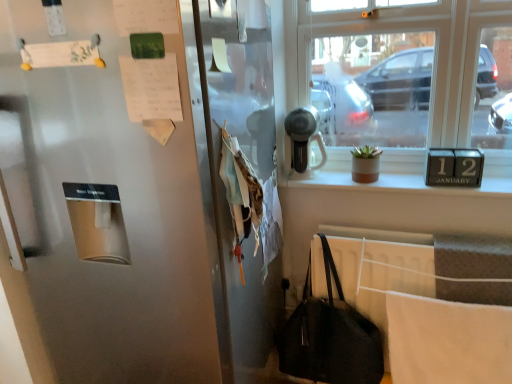
Question: Is clear glass window at upper right at the right side of satin silver hairdryer at upper center?

Choices:
 (A) yes
 (B) no

Answer: (A)

Question: Does clear glass window at upper right have a lesser height compared to satin silver hairdryer at upper center?

Choices:
 (A) no
 (B) yes

Answer: (A)

Question: Considering the relative positions of clear glass window at upper right and satin silver hairdryer at upper center in the image provided, is clear glass window at upper right in front of satin silver hairdryer at upper center?

Choices:
 (A) yes
 (B) no

Answer: (A)

Question: From a real-world perspective, is clear glass window at upper right on top of satin silver hairdryer at upper center?

Choices:
 (A) no
 (B) yes

Answer: (B)

Question: Could you tell me if clear glass window at upper right is facing satin silver hairdryer at upper center?

Choices:
 (A) no
 (B) yes

Answer: (B)

Question: Is clear glass window at upper right at the left side of satin silver hairdryer at upper center?

Choices:
 (A) no
 (B) yes

Answer: (A)

Question: Could clear glass window at upper right be considered to be inside black leather handbag at lower right?

Choices:
 (A) no
 (B) yes

Answer: (A)

Question: Considering the relative sizes of black leather handbag at lower right and clear glass window at upper right in the image provided, is black leather handbag at lower right wider than clear glass window at upper right?

Choices:
 (A) no
 (B) yes

Answer: (B)

Question: Does black leather handbag at lower right come behind clear glass window at upper right?

Choices:
 (A) no
 (B) yes

Answer: (A)

Question: Is black leather handbag at lower right at the left side of clear glass window at upper right?

Choices:
 (A) no
 (B) yes

Answer: (B)

Question: Can you confirm if black leather handbag at lower right is smaller than clear glass window at upper right?

Choices:
 (A) no
 (B) yes

Answer: (B)

Question: Is black leather handbag at lower right closer to camera compared to clear glass window at upper right?

Choices:
 (A) no
 (B) yes

Answer: (B)

Question: From a real-world perspective, is satin silver refrigerator at left over white paper at upper left, marked as the first paper in a bottom-to-top arrangement?

Choices:
 (A) no
 (B) yes

Answer: (A)